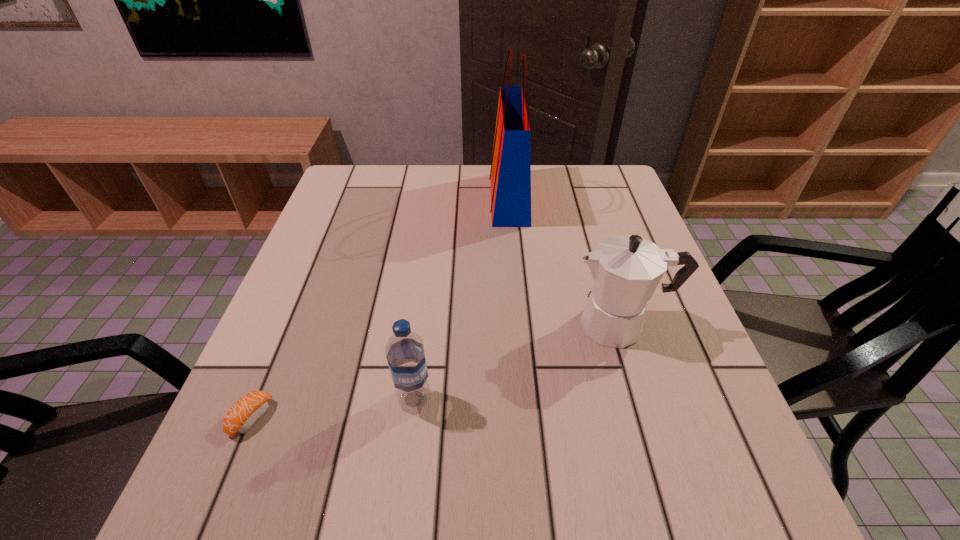
Find the location of a particular element. free spot between the rightmost object and the tallest object is located at coordinates (564, 262).

This screenshot has height=540, width=960. Find the location of `free area in between the sushi and the coffeepot`. free area in between the sushi and the coffeepot is located at coordinates (436, 371).

In order to click on free space between the sushi and the coffeepot in this screenshot , I will do `click(436, 371)`.

Where is `vacant area that lies between the farthest object and the coffeepot`? Image resolution: width=960 pixels, height=540 pixels. vacant area that lies between the farthest object and the coffeepot is located at coordinates (564, 262).

At what (x,y) coordinates should I click in order to perform the action: click on blank region between the sushi and the farthest object. Please return your answer as a coordinate pair (x, y). The height and width of the screenshot is (540, 960). Looking at the image, I should click on (380, 308).

Choose which object is the second nearest neighbor to the coffeepot. Please provide its 2D coordinates. Your answer should be formatted as a tuple, i.e. [(x, y)], where the tuple contains the x and y coordinates of a point satisfying the conditions above.

[(405, 355)]

Image resolution: width=960 pixels, height=540 pixels. I want to click on object that ranks as the third closest to the leftmost object, so click(x=510, y=176).

The width and height of the screenshot is (960, 540). Find the location of `free region that satisfies the following two spatial constraints: 1. on the handle side of the shopping bag; 2. on the label of the water bottle`. free region that satisfies the following two spatial constraints: 1. on the handle side of the shopping bag; 2. on the label of the water bottle is located at coordinates (526, 399).

Where is `vacant region that satisfies the following two spatial constraints: 1. on the handle side of the third object from left to right; 2. on the front side of the leftmost object`? vacant region that satisfies the following two spatial constraints: 1. on the handle side of the third object from left to right; 2. on the front side of the leftmost object is located at coordinates [x=528, y=418].

I want to click on vacant region that satisfies the following two spatial constraints: 1. on the handle side of the second object from right to left; 2. on the front side of the sushi, so click(x=528, y=418).